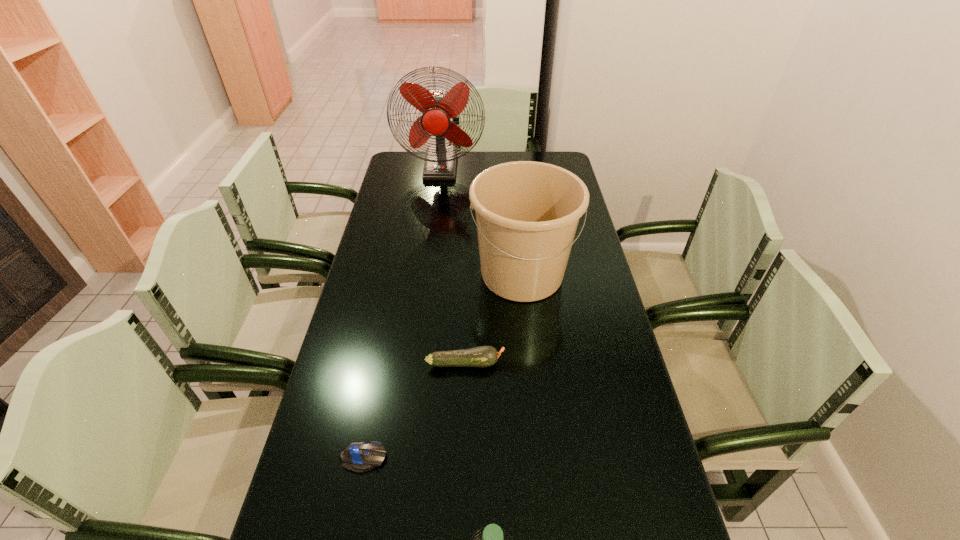
Where is `free spot between the fourth farthest object and the farthest object`? Image resolution: width=960 pixels, height=540 pixels. free spot between the fourth farthest object and the farthest object is located at coordinates (402, 312).

The image size is (960, 540). I want to click on free space between the farthest object and the fourth farthest object, so click(402, 312).

Identify the location of free spot between the farthest object and the computer mouse. [402, 312].

This screenshot has width=960, height=540. I want to click on vacant space that is in between the third nearest object and the tallest object, so click(x=453, y=265).

This screenshot has height=540, width=960. I want to click on object that can be found as the fourth closest to the shortest object, so click(x=437, y=106).

Locate an element on the screen. object that is the second nearest to the second farthest object is located at coordinates (437, 106).

Identify the location of vacant region that satisfies the following two spatial constraints: 1. on the front side of the second farthest object; 2. at the blossom end of the fourth tallest object. (532, 363).

The width and height of the screenshot is (960, 540). What are the coordinates of `vacant area in the image that satisfies the following two spatial constraints: 1. on the front-facing side of the fan; 2. on the right side of the second farthest object` in the screenshot? It's located at (426, 274).

Find the location of a particular element. Image resolution: width=960 pixels, height=540 pixels. free space that satisfies the following two spatial constraints: 1. on the front-facing side of the fan; 2. on the button side of the second nearest object is located at coordinates (402, 458).

The height and width of the screenshot is (540, 960). Find the location of `vacant space that satisfies the following two spatial constraints: 1. on the front-facing side of the bucket; 2. on the left side of the tallest object`. vacant space that satisfies the following two spatial constraints: 1. on the front-facing side of the bucket; 2. on the left side of the tallest object is located at coordinates (426, 274).